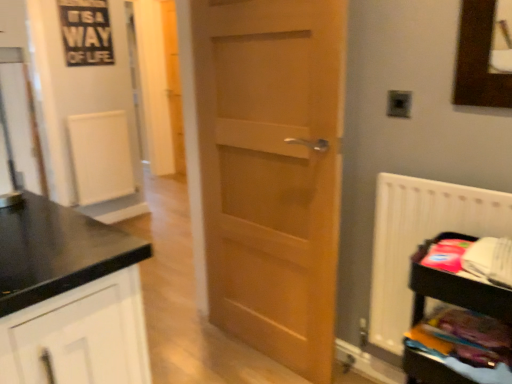
Question: From a real-world perspective, is white plastic radiator at right above or below wooden shelf at lower right?

Choices:
 (A) below
 (B) above

Answer: (B)

Question: In terms of width, does white plastic radiator at right look wider or thinner when compared to wooden shelf at lower right?

Choices:
 (A) thin
 (B) wide

Answer: (A)

Question: Estimate the real-world distances between objects in this image. Which object is farther from the white plastic radiator at right?

Choices:
 (A) transparent glass door at left
 (B) light brown wood door at center
 (C) wooden shelf at lower right
 (D) metallic silver electric outlet at upper right

Answer: (A)

Question: Which is nearer to the wooden shelf at lower right?

Choices:
 (A) light brown wood door at center
 (B) metallic silver electric outlet at upper right
 (C) transparent glass door at left
 (D) white plastic radiator at right

Answer: (D)